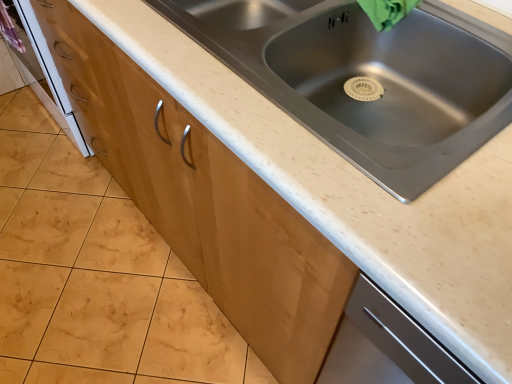
This screenshot has height=384, width=512. What do you see at coordinates (366, 75) in the screenshot?
I see `stainless steel sink at center` at bounding box center [366, 75].

What do you see at coordinates (204, 201) in the screenshot? This screenshot has height=384, width=512. I see `matte wood cabinet at center` at bounding box center [204, 201].

Locate an element on the screen. The image size is (512, 384). stainless steel sink at center is located at coordinates (366, 75).

Between matte wood cabinet at center and white glossy oven at lower left, which one appears on the left side from the viewer's perspective?

Positioned to the left is white glossy oven at lower left.

What's the angular difference between matte wood cabinet at center and white glossy oven at lower left's facing directions?

Result: They differ by 90 degrees in their facing directions.

Is white glossy oven at lower left surrounded by matte wood cabinet at center?

Actually, white glossy oven at lower left is outside matte wood cabinet at center.

Can you confirm if matte wood cabinet at center is smaller than white glossy oven at lower left?

Indeed, matte wood cabinet at center has a smaller size compared to white glossy oven at lower left.

What's the angular difference between matte wood cabinet at center and stainless steel sink at center's facing directions?

90 degrees.

Considering the relative sizes of matte wood cabinet at center and stainless steel sink at center in the image provided, is matte wood cabinet at center shorter than stainless steel sink at center?

Yes.

From a real-world perspective, is matte wood cabinet at center under stainless steel sink at center?

Indeed, from a real-world perspective, matte wood cabinet at center is positioned beneath stainless steel sink at center.

Can you confirm if white glossy oven at lower left is positioned to the right of stainless steel sink at center?

In fact, white glossy oven at lower left is to the left of stainless steel sink at center.

Is white glossy oven at lower left closer to camera compared to stainless steel sink at center?

That is False.

Is stainless steel sink at center a part of white glossy oven at lower left?

No.

Is white glossy oven at lower left wider or thinner than stainless steel sink at center?

white glossy oven at lower left is thinner than stainless steel sink at center.

Does white glossy oven at lower left appear on the left side of matte wood cabinet at center?

Indeed, white glossy oven at lower left is positioned on the left side of matte wood cabinet at center.

Is white glossy oven at lower left surrounding matte wood cabinet at center?

Actually, matte wood cabinet at center is outside white glossy oven at lower left.

Is white glossy oven at lower left taller than matte wood cabinet at center?

Yes, white glossy oven at lower left is taller than matte wood cabinet at center.

Is stainless steel sink at center bigger or smaller than white glossy oven at lower left?

stainless steel sink at center is smaller than white glossy oven at lower left.

Is stainless steel sink at center directly adjacent to white glossy oven at lower left?

They are not placed beside each other.

Is stainless steel sink at center outside of white glossy oven at lower left?

Yes.

From a real-world perspective, who is located lower, stainless steel sink at center or matte wood cabinet at center?

matte wood cabinet at center, from a real-world perspective.

Looking at this image, from the image's perspective, is stainless steel sink at center located beneath matte wood cabinet at center?

No, from the image's perspective, stainless steel sink at center is not below matte wood cabinet at center.

Is stainless steel sink at center outside of matte wood cabinet at center?

Yes, stainless steel sink at center is located beyond the bounds of matte wood cabinet at center.

Which object is wider, stainless steel sink at center or matte wood cabinet at center?

matte wood cabinet at center.

Locate an element on the screen. The height and width of the screenshot is (384, 512). oven located above the matte wood cabinet at center (from a real-world perspective) is located at coordinates (44, 74).

Locate an element on the screen. The image size is (512, 384). cabinetry behind the stainless steel sink at center is located at coordinates (204, 201).

Looking at this image, estimate the real-world distances between objects in this image. Which object is closer to stainless steel sink at center, white glossy oven at lower left or matte wood cabinet at center?

matte wood cabinet at center is positioned closer to the anchor stainless steel sink at center.

When comparing their distances from matte wood cabinet at center, does white glossy oven at lower left or stainless steel sink at center seem further?

Based on the image, white glossy oven at lower left appears to be further to matte wood cabinet at center.

Based on their spatial positions, is stainless steel sink at center or white glossy oven at lower left closer to matte wood cabinet at center?

stainless steel sink at center is positioned closer to the anchor matte wood cabinet at center.

From the image, which object appears to be nearer to white glossy oven at lower left, matte wood cabinet at center or stainless steel sink at center?

matte wood cabinet at center is closer to white glossy oven at lower left.

Looking at the image, which one is located closer to stainless steel sink at center, matte wood cabinet at center or white glossy oven at lower left?

matte wood cabinet at center lies closer to stainless steel sink at center than the other object.

Considering their positions, is stainless steel sink at center positioned further to white glossy oven at lower left than matte wood cabinet at center?

Based on the image, stainless steel sink at center appears to be further to white glossy oven at lower left.

What are the coordinates of `cabinetry between white glossy oven at lower left and stainless steel sink at center` in the screenshot? It's located at (204, 201).